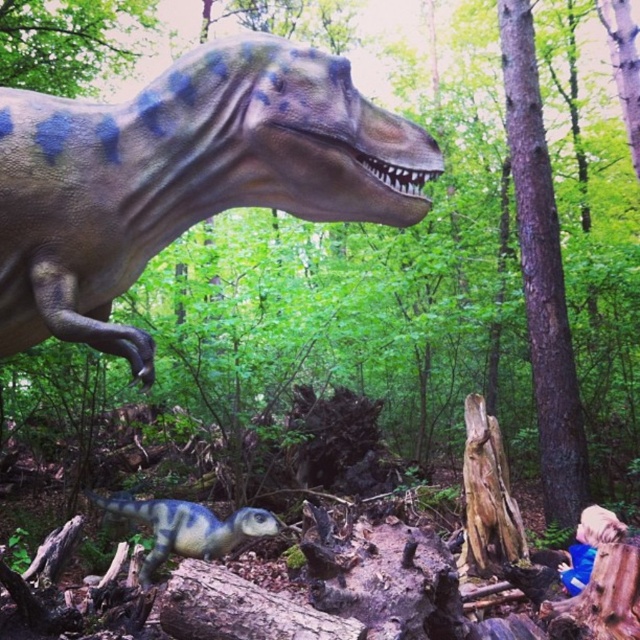
Question: In this image, where is shiny metallic dinosaur at upper center located relative to blue-green textured dinosaur at lower center?

Choices:
 (A) left
 (B) right

Answer: (B)

Question: Among these points, which one is nearest to the camera?

Choices:
 (A) (84, 298)
 (B) (120, 504)

Answer: (A)

Question: Is shiny metallic dinosaur at upper center thinner than blue-green textured dinosaur at lower center?

Choices:
 (A) no
 (B) yes

Answer: (A)

Question: Which point appears closest to the camera in this image?

Choices:
 (A) (154, 80)
 (B) (212, 538)

Answer: (A)

Question: Which object is farther from the camera taking this photo?

Choices:
 (A) blue-green textured dinosaur at lower center
 (B) shiny metallic dinosaur at upper center

Answer: (A)

Question: Observing the image, what is the correct spatial positioning of shiny metallic dinosaur at upper center in reference to blue-green textured dinosaur at lower center?

Choices:
 (A) left
 (B) right

Answer: (B)